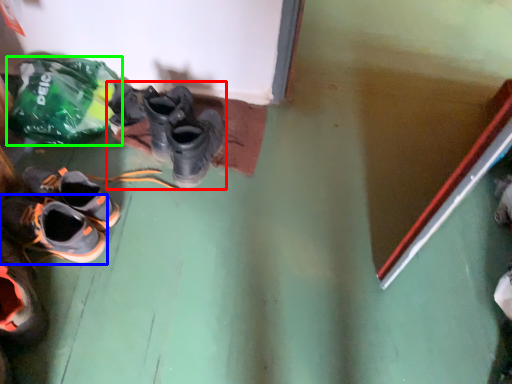
Question: Considering the real-world distances, which object is closest to footwear (highlighted by a red box)? shoe (highlighted by a blue box) or plastic bag (highlighted by a green box).

Choices:
 (A) shoe
 (B) plastic bag

Answer: (B)